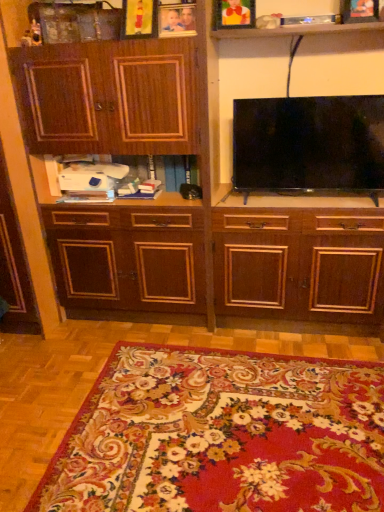
Question: Is point (354, 20) positioned closer to the camera than point (182, 128)?

Choices:
 (A) farther
 (B) closer

Answer: (B)

Question: From the image's perspective, is wooden picture frame at upper right, positioned as the fourth picture frame in left-to-right order, above or below dark wood cabinet at center?

Choices:
 (A) below
 (B) above

Answer: (B)

Question: Which of these objects is positioned farthest from the wooden picture frame at upper right, the 1th picture frame positioned from the right?

Choices:
 (A) white plastic printer at center
 (B) wooden picture frame at upper center, which is the 1th picture frame in left-to-right order
 (C) floral carpet at lower center
 (D) black glossy flat-screen tv at upper center
 (E) wooden picture frame at upper center, the second picture frame in the right-to-left sequence

Answer: (C)

Question: Estimate the real-world distances between objects in this image. Which object is closer to the wooden photo frame at upper center, marked as the second picture frame in a left-to-right arrangement?

Choices:
 (A) wooden picture frame at upper center, which is the 1th picture frame in left-to-right order
 (B) wooden picture frame at upper right, positioned as the fourth picture frame in left-to-right order
 (C) white plastic printer at center
 (D) wooden picture frame at upper center, the second picture frame in the right-to-left sequence
 (E) floral carpet at lower center

Answer: (A)